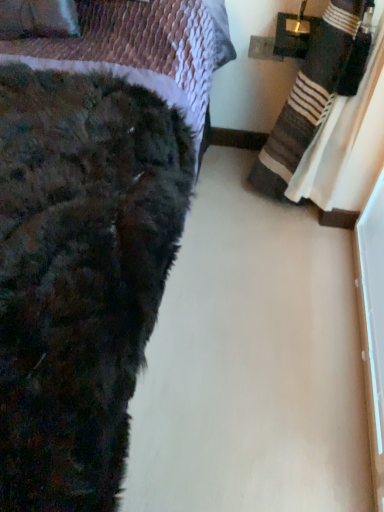
At what (x,y) coordinates should I click in order to perform the action: click on free space below striped cotton blanket at right (from a real-world perspective). Please return your answer as a coordinate pair (x, y). Looking at the image, I should click on (279, 220).